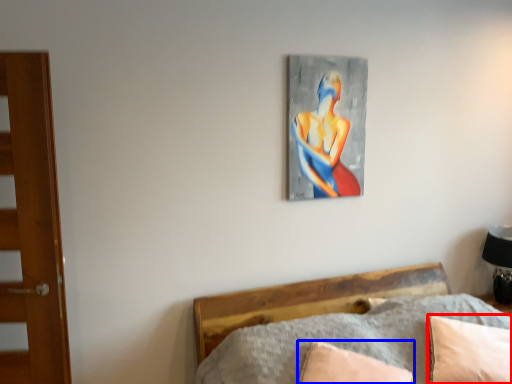
Question: Which object appears farthest to the camera in this image, pillow (highlighted by a red box) or pillow (highlighted by a blue box)?

Choices:
 (A) pillow
 (B) pillow

Answer: (A)